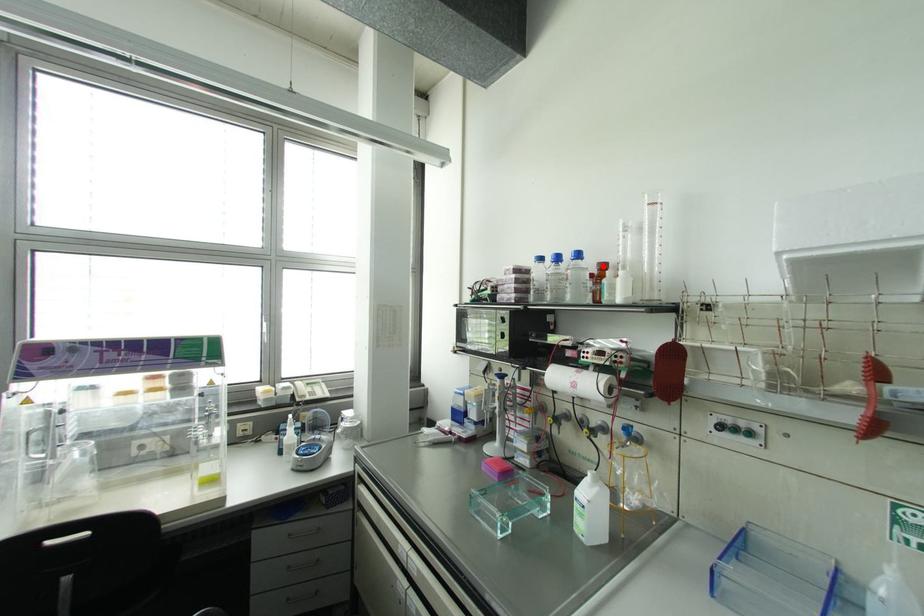
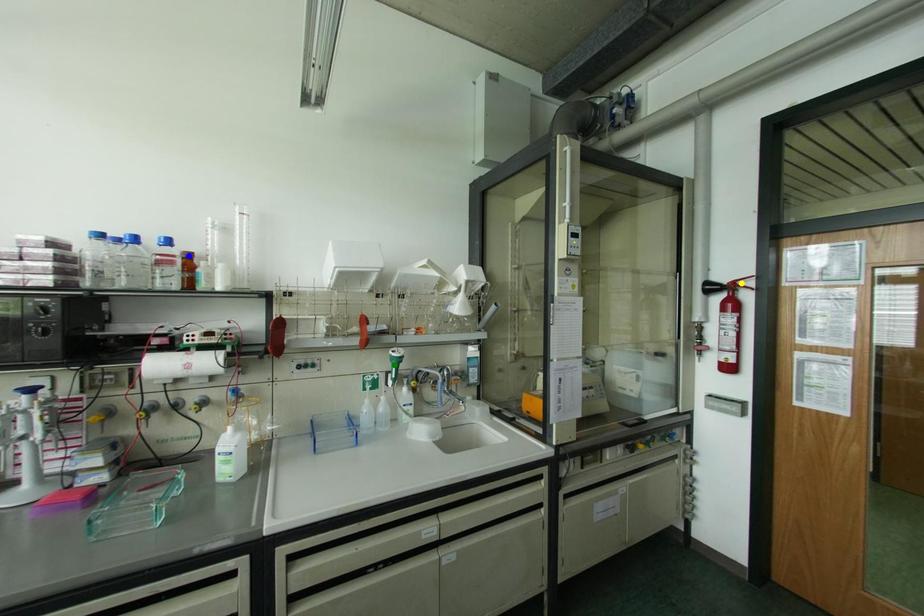
Question: I am providing you with two images of the same scene from different viewpoints. A red point is marked on the first image. You are given multiple points on the second image. Which mark in image 2 goes with the point in image 1?

Choices:
 (A) yellow point
 (B) blue point
 (C) green point

Answer: (B)